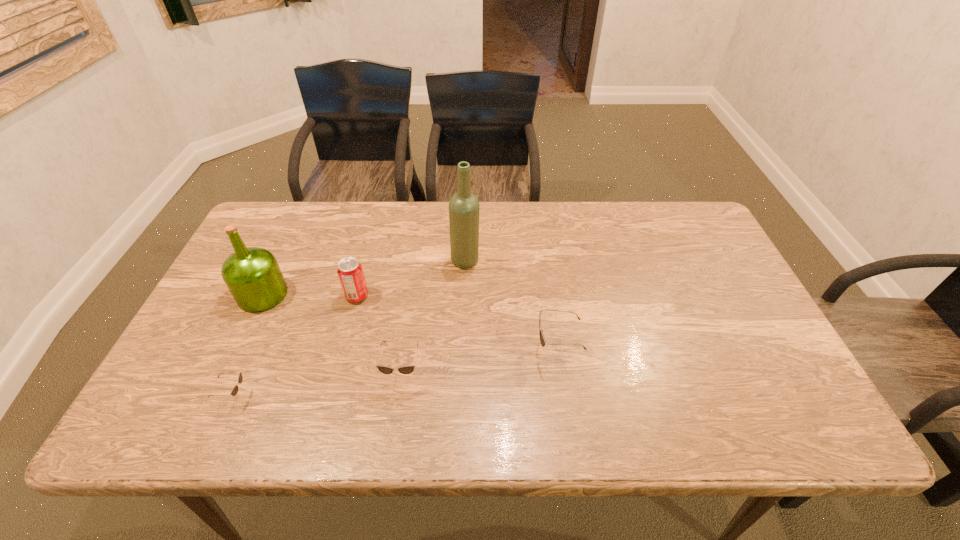
Identify the location of the shortest sunglasses. (234, 391).

You are a GUI agent. You are given a task and a screenshot of the screen. Output one action in this format:
    pyautogui.click(x=<x>, y=<y>)
    Task: Click on the leftmost sunglasses
    
    Given the screenshot: What is the action you would take?
    pos(234,391)

This screenshot has height=540, width=960. Find the location of `the second shortest sunglasses`. the second shortest sunglasses is located at coordinates (408, 369).

Identify the location of the second sunglasses from right to left. (408, 369).

At what (x,y) coordinates should I click in order to perform the action: click on the rightmost sunglasses. Please return your answer as a coordinate pair (x, y). Looking at the image, I should click on (542, 339).

Find the location of `the fourth object from right to left`. the fourth object from right to left is located at coordinates point(349,270).

Locate an element on the screen. The width and height of the screenshot is (960, 540). the fifth shortest object is located at coordinates (252, 275).

Find the location of a particular element. This screenshot has height=540, width=960. the farthest object is located at coordinates (464, 207).

Where is `the tallest object`? The image size is (960, 540). the tallest object is located at coordinates (464, 207).

Locate an element on the screen. The width and height of the screenshot is (960, 540). vacant space located 0.100m in front of the lenses of the shortest sunglasses is located at coordinates (293, 396).